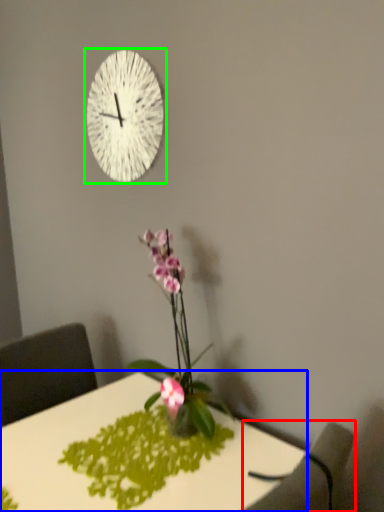
Question: Which object is the closest to the armchair (highlighted by a red box)? Choose among these: desk (highlighted by a blue box) or wall clock (highlighted by a green box).

Choices:
 (A) desk
 (B) wall clock

Answer: (A)